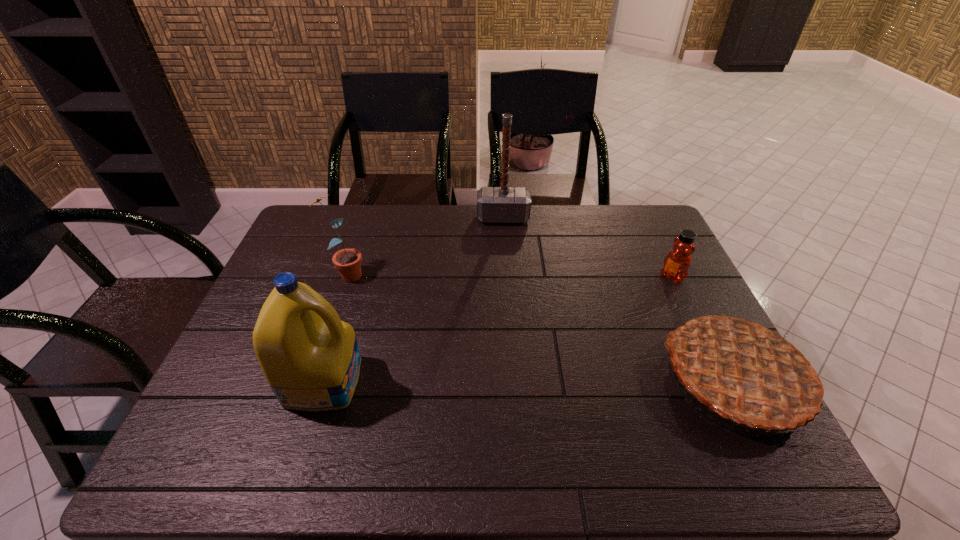
Where is `vacant space on the desktop that is between the detergent and the pie and is positioned on the striking surface of the third object from left to right`? Image resolution: width=960 pixels, height=540 pixels. vacant space on the desktop that is between the detergent and the pie and is positioned on the striking surface of the third object from left to right is located at coordinates (507, 380).

The image size is (960, 540). Identify the location of free space on the desktop that is between the detergent and the pie and is positioned on the front label of the shortest object. (525, 380).

At what (x,y) coordinates should I click in order to perform the action: click on vacant space on the desktop that is between the detergent and the pie and is positioned on the flower of the sunflower. Please return your answer as a coordinate pair (x, y). Looking at the image, I should click on (559, 380).